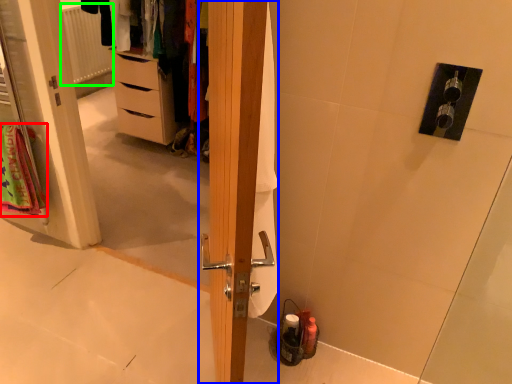
Question: Considering the real-world distances, which object is closest to bath towel (highlighted by a red box)? door (highlighted by a blue box) or radiator (highlighted by a green box).

Choices:
 (A) door
 (B) radiator

Answer: (A)